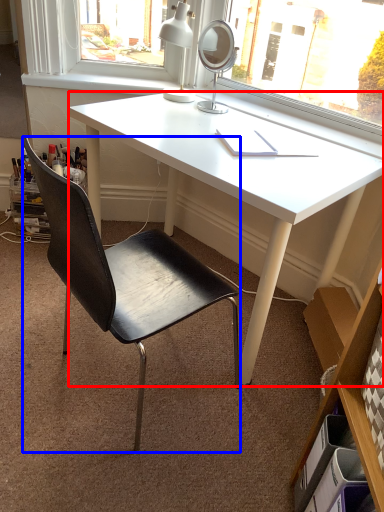
Question: Which point is closer to the camera, desk (highlighted by a red box) or chair (highlighted by a blue box)?

Choices:
 (A) desk
 (B) chair

Answer: (B)